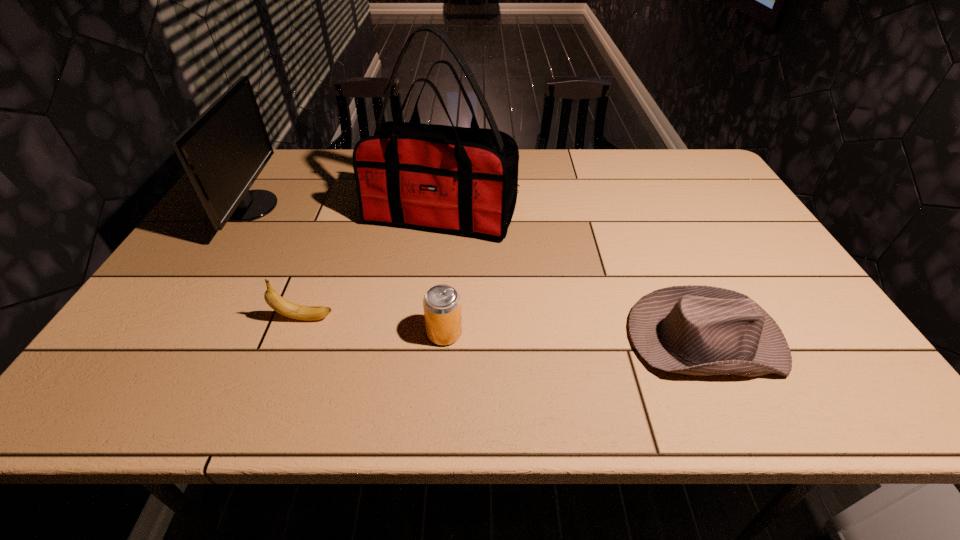
The width and height of the screenshot is (960, 540). Identify the location of empty space between the rightmost object and the monitor. (477, 273).

Find the location of a particular element. free space between the pop (soda) and the banana is located at coordinates (374, 326).

Where is `free point between the duffel bag and the pop (soda)`? Image resolution: width=960 pixels, height=540 pixels. free point between the duffel bag and the pop (soda) is located at coordinates (444, 274).

Where is `object that is the fourth closest to the pop (soda)`? object that is the fourth closest to the pop (soda) is located at coordinates (224, 150).

You are a GUI agent. You are given a task and a screenshot of the screen. Output one action in this format:
    pyautogui.click(x=<x>, y=<y>)
    Task: Click on the object that ranks as the third closest to the banana
    
    Given the screenshot: What is the action you would take?
    pyautogui.click(x=224, y=150)

Identify the location of free space that satisfies the following two spatial constraints: 1. at the start of the peel on the banana; 2. on the left side of the rightmost object. The width and height of the screenshot is (960, 540). [298, 339].

Find the location of `vacant space that satisfies the following two spatial constraints: 1. on the front side of the tallest object; 2. on the left side of the fedora`. vacant space that satisfies the following two spatial constraints: 1. on the front side of the tallest object; 2. on the left side of the fedora is located at coordinates click(429, 339).

The width and height of the screenshot is (960, 540). Identify the location of vacant space that satisfies the following two spatial constraints: 1. on the front side of the pop (soda); 2. on the right side of the tallest object. (429, 333).

Find the location of `free space that satisfies the following two spatial constraints: 1. on the screen side of the monitor; 2. on the left side of the rightmost object`. free space that satisfies the following two spatial constraints: 1. on the screen side of the monitor; 2. on the left side of the rightmost object is located at coordinates (164, 339).

The width and height of the screenshot is (960, 540). What are the coordinates of `free space in the image that satisfies the following two spatial constraints: 1. at the start of the peel on the banana; 2. on the back side of the fedora` in the screenshot? It's located at (298, 339).